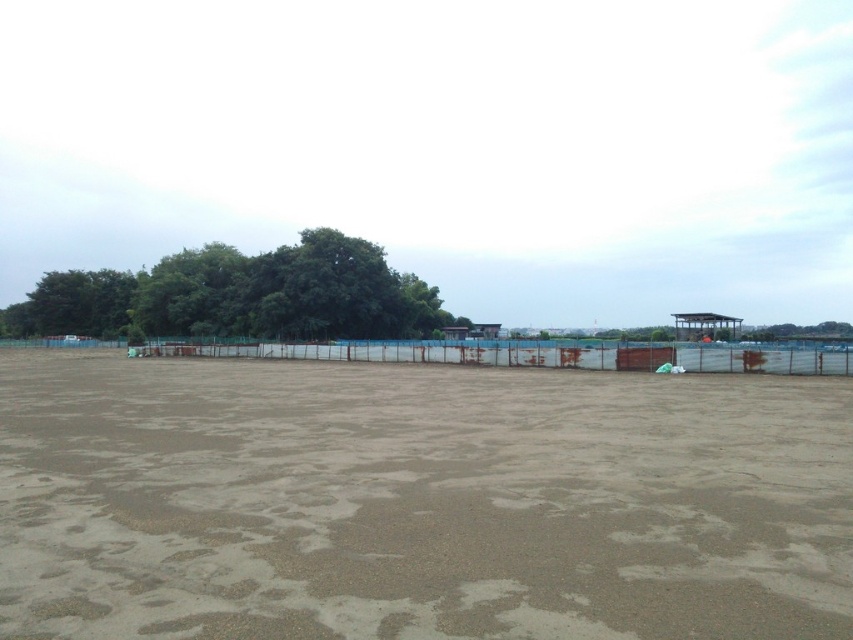
Does brown sandy dirt field at center have a lesser width compared to green leafy tree at upper left?

Correct, brown sandy dirt field at center's width is less than green leafy tree at upper left's.

Does brown sandy dirt field at center have a greater height compared to green leafy tree at upper left?

In fact, brown sandy dirt field at center may be shorter than green leafy tree at upper left.

Which is in front, point (125, 556) or point (339, 323)?

Point (125, 556) is more forward.

The width and height of the screenshot is (853, 640). Identify the location of brown sandy dirt field at center. 416,502.